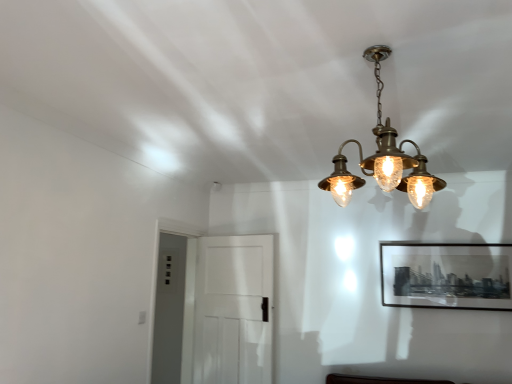
Question: From the image's perspective, is brass/bronze chandelier at upper center under white matte door at center?

Choices:
 (A) yes
 (B) no

Answer: (B)

Question: Considering the relative sizes of brass/bronze chandelier at upper center and white matte door at center in the image provided, is brass/bronze chandelier at upper center shorter than white matte door at center?

Choices:
 (A) no
 (B) yes

Answer: (B)

Question: From the image's perspective, is brass/bronze chandelier at upper center on white matte door at center?

Choices:
 (A) yes
 (B) no

Answer: (A)

Question: Is brass/bronze chandelier at upper center not within white matte door at center?

Choices:
 (A) yes
 (B) no

Answer: (A)

Question: Can you confirm if brass/bronze chandelier at upper center is wider than white matte door at center?

Choices:
 (A) yes
 (B) no

Answer: (A)

Question: Does brass/bronze chandelier at upper center come behind white matte door at center?

Choices:
 (A) yes
 (B) no

Answer: (B)

Question: From a real-world perspective, does black matte picture frame at upper right sit lower than brass/bronze chandelier at upper center?

Choices:
 (A) yes
 (B) no

Answer: (A)

Question: Is black matte picture frame at upper right further to the viewer compared to brass/bronze chandelier at upper center?

Choices:
 (A) no
 (B) yes

Answer: (B)

Question: Is brass/bronze chandelier at upper center located within black matte picture frame at upper right?

Choices:
 (A) yes
 (B) no

Answer: (B)

Question: Is black matte picture frame at upper right bigger than brass/bronze chandelier at upper center?

Choices:
 (A) no
 (B) yes

Answer: (A)

Question: From the image's perspective, does black matte picture frame at upper right appear lower than brass/bronze chandelier at upper center?

Choices:
 (A) yes
 (B) no

Answer: (A)

Question: Considering the relative sizes of black matte picture frame at upper right and brass/bronze chandelier at upper center in the image provided, is black matte picture frame at upper right wider than brass/bronze chandelier at upper center?

Choices:
 (A) no
 (B) yes

Answer: (A)

Question: Is the depth of black matte picture frame at upper right greater than that of white matte door at center?

Choices:
 (A) yes
 (B) no

Answer: (A)